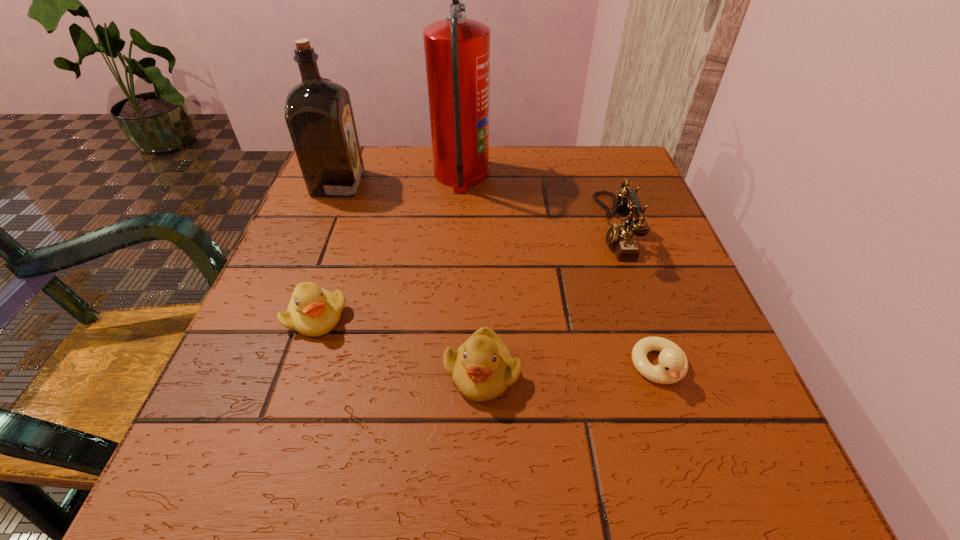
This screenshot has width=960, height=540. Find the location of `fire extinguisher`. fire extinguisher is located at coordinates (457, 50).

You are a GUI agent. You are given a task and a screenshot of the screen. Output one action in this format:
    pyautogui.click(x=<x>, y=<y>)
    Task: Click on the liquor
    The height and width of the screenshot is (540, 960).
    Given the screenshot: What is the action you would take?
    pyautogui.click(x=318, y=112)

What are the coordinates of `telephone` in the screenshot? It's located at (621, 236).

The height and width of the screenshot is (540, 960). I want to click on the second duckling from right to left, so click(x=482, y=368).

I want to click on the fourth farthest object, so click(x=313, y=311).

At what (x,y) coordinates should I click in order to perform the action: click on the leftmost duckling. Please return your answer as a coordinate pair (x, y). This screenshot has height=540, width=960. Looking at the image, I should click on (313, 311).

Image resolution: width=960 pixels, height=540 pixels. I want to click on the shortest object, so click(673, 365).

Identify the location of the rightmost duckling. (673, 365).

The height and width of the screenshot is (540, 960). Identify the location of vacant region located 0.280m on the instruction side of the tallest object. (612, 174).

The height and width of the screenshot is (540, 960). Identify the location of blank area located on the label of the liquor. (451, 183).